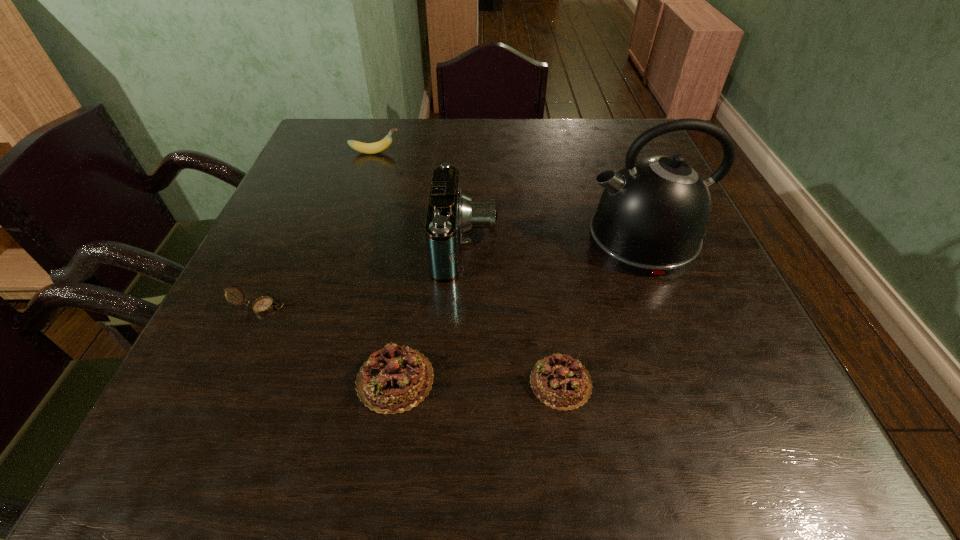
At what (x,y) coordinates should I click in order to perform the action: click on vacant area situated 0.270m on the left of the left chocolate cake. Please return your answer as a coordinate pair (x, y). The width and height of the screenshot is (960, 540). Looking at the image, I should click on (189, 379).

At what (x,y) coordinates should I click in order to perform the action: click on free space located 0.060m on the right of the fifth object from left to right. Please return your answer as a coordinate pair (x, y). The image size is (960, 540). Looking at the image, I should click on (630, 382).

You are a GUI agent. You are given a task and a screenshot of the screen. Output one action in this format:
    pyautogui.click(x=<x>, y=<y>)
    Task: Click on the free space located 0.260m at the stem of the banana
    
    Given the screenshot: What is the action you would take?
    pyautogui.click(x=496, y=153)

The image size is (960, 540). I want to click on free location located on the spout of the rightmost object, so click(517, 240).

Locate an element on the screen. blank space located 0.360m on the spout of the rightmost object is located at coordinates (416, 240).

This screenshot has height=540, width=960. I want to click on blank space located on the spout of the rightmost object, so click(x=485, y=240).

Identify the location of vacant region located 0.300m on the face of the leftmost object. Image resolution: width=960 pixels, height=540 pixels. (446, 307).

At what (x,y) coordinates should I click in order to perform the action: click on blank area located on the front-facing side of the fifth shortest object. Please return your answer as a coordinate pair (x, y). The height and width of the screenshot is (540, 960). Looking at the image, I should click on (572, 244).

Where is `object at the far edge`? The image size is (960, 540). object at the far edge is located at coordinates (367, 148).

The image size is (960, 540). What are the coordinates of `banana present at the left edge` in the screenshot? It's located at (367, 148).